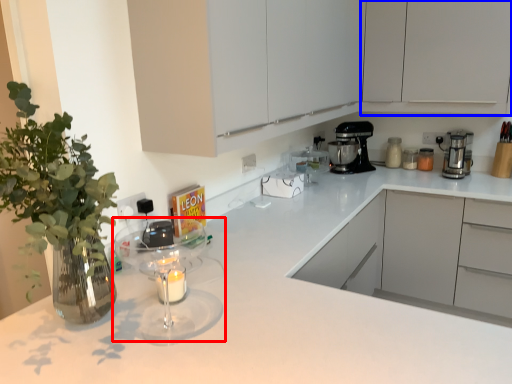
Question: Which of the following is the closest to the observer, mixer (highlighted by a red box) or cabinetry (highlighted by a blue box)?

Choices:
 (A) mixer
 (B) cabinetry

Answer: (A)